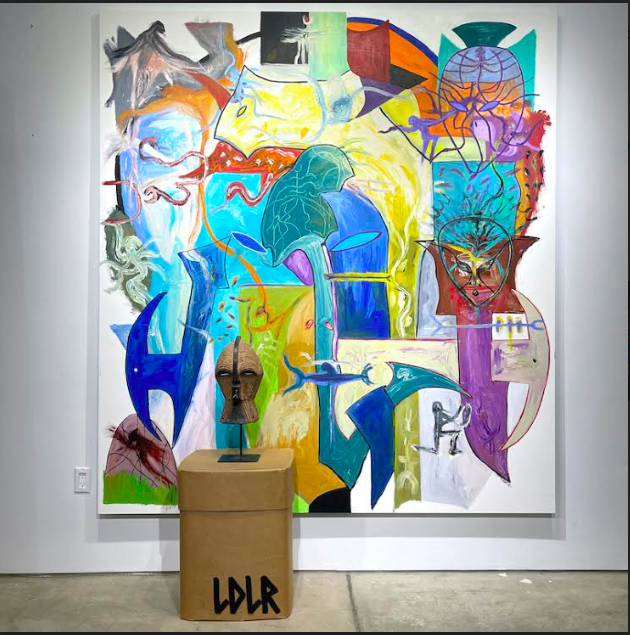
Locate an element on the screen. floor is located at coordinates (598, 585).